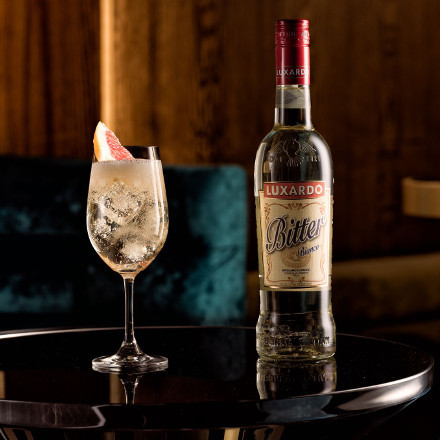
Where is `bottle`? The image size is (440, 440). bottle is located at coordinates (306, 169).